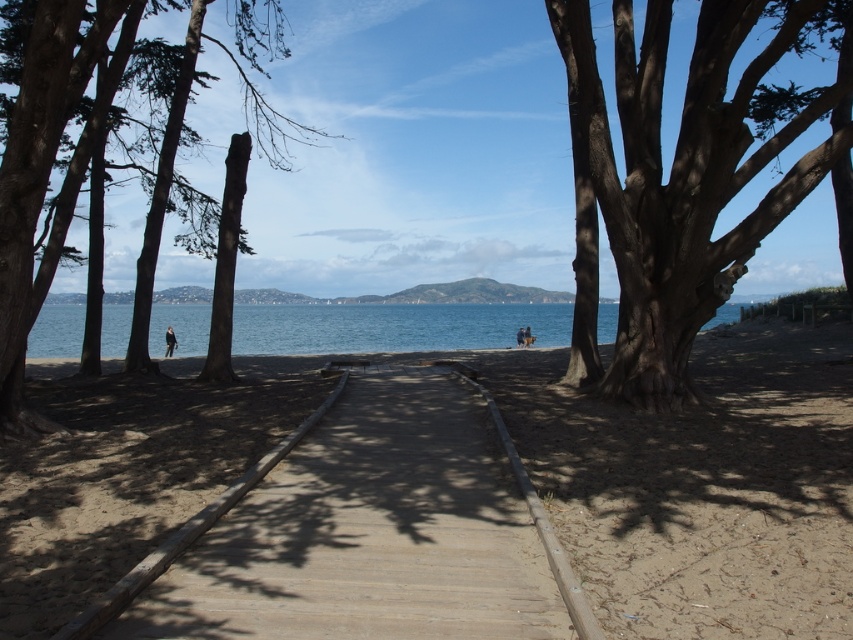
Who is positioned more to the right, smooth brown tree trunk at right or blue water at center?

Positioned to the right is smooth brown tree trunk at right.

Between smooth brown tree trunk at right and blue water at center, which one has less height?

blue water at center

Is point (717, 244) closer to camera compared to point (114, 321)?

Yes, point (717, 244) is closer to viewer.

Where is `smooth brown tree trunk at right`? The image size is (853, 640). smooth brown tree trunk at right is located at coordinates (x=676, y=180).

Is wooden boardwalk at center positioned at the back of smooth brown tree trunk at right?

That is False.

Can you confirm if wooden boardwalk at center is shorter than smooth brown tree trunk at right?

Yes, wooden boardwalk at center is shorter than smooth brown tree trunk at right.

Who is more forward, (283,620) or (633,330)?

Point (283,620)

Image resolution: width=853 pixels, height=640 pixels. Identify the location of wooden boardwalk at center. (367, 531).

Does wooden boardwalk at center lie behind blue water at center?

No, wooden boardwalk at center is in front of blue water at center.

Which of these two, wooden boardwalk at center or blue water at center, stands shorter?

With less height is wooden boardwalk at center.

Find the location of a particular element. The width and height of the screenshot is (853, 640). wooden boardwalk at center is located at coordinates (367, 531).

Image resolution: width=853 pixels, height=640 pixels. In order to click on wooden boardwalk at center in this screenshot , I will do `click(367, 531)`.